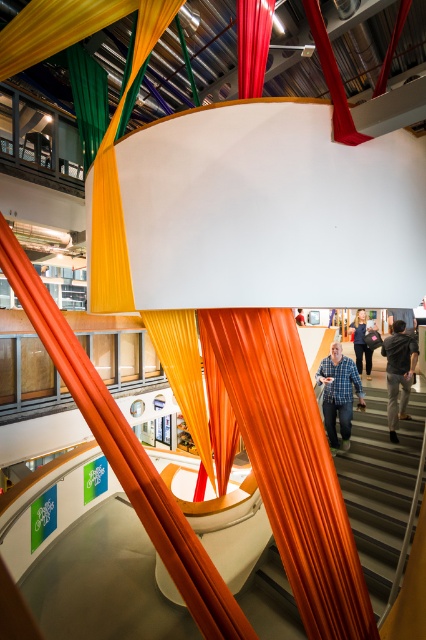
Question: Does orange fabric at lower center lie behind dark gray shirt at upper center?

Choices:
 (A) yes
 (B) no

Answer: (B)

Question: Does orange fabric at lower center have a larger size compared to blue denim jeans at center?

Choices:
 (A) yes
 (B) no

Answer: (A)

Question: Is the position of blue plaid shirt at center more distant than that of red silk curtain at center?

Choices:
 (A) no
 (B) yes

Answer: (B)

Question: Which of these objects is positioned closest to the orange fabric at lower center?

Choices:
 (A) orange silky curtain at center
 (B) blue denim jeans at center
 (C) orange fabric at center
 (D) red silk curtain at center

Answer: (A)

Question: Which point is farther to the camera?

Choices:
 (A) (373, 525)
 (B) (402, 412)

Answer: (B)

Question: Which of these objects is positioned farthest from the orange fabric at center?

Choices:
 (A) dark gray shirt at upper center
 (B) blue denim jeans at center
 (C) orange fabric at lower center
 (D) orange fabric curtain at center

Answer: (D)